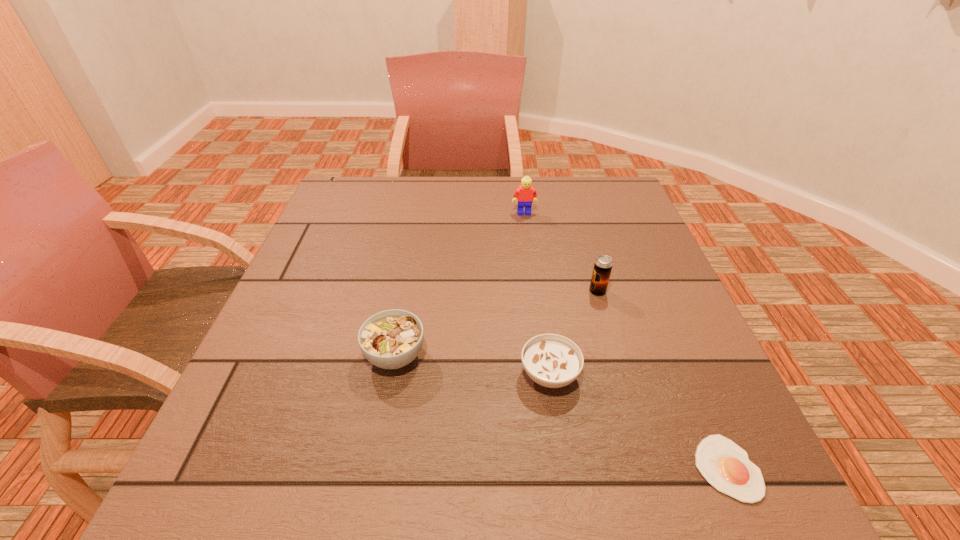
Image resolution: width=960 pixels, height=540 pixels. In the image, there is a desktop. Identify the location of vacant space at the far edge. (415, 212).

Image resolution: width=960 pixels, height=540 pixels. I want to click on vacant region at the left edge of the desktop, so click(x=338, y=269).

The width and height of the screenshot is (960, 540). I want to click on vacant area at the right edge, so pyautogui.click(x=652, y=280).

In the image, there is a desktop. In order to click on vacant space at the far left corner in this screenshot , I will do `click(364, 192)`.

This screenshot has height=540, width=960. In the image, there is a desktop. Identify the location of free space at the far right corner. (607, 183).

The width and height of the screenshot is (960, 540). In order to click on free space that is in between the rightmost object and the shorter soup bowl in this screenshot , I will do `click(638, 421)`.

Identify the location of vacant area that lies between the tallest object and the fourth tallest object. This screenshot has height=540, width=960. (537, 294).

The width and height of the screenshot is (960, 540). In order to click on free space between the nearest object and the shorter soup bowl in this screenshot , I will do `click(638, 421)`.

I want to click on vacant area that lies between the shortest object and the fourth shortest object, so click(662, 380).

This screenshot has width=960, height=540. Identify the location of vacant point located between the leftmost object and the second farthest object. (496, 323).